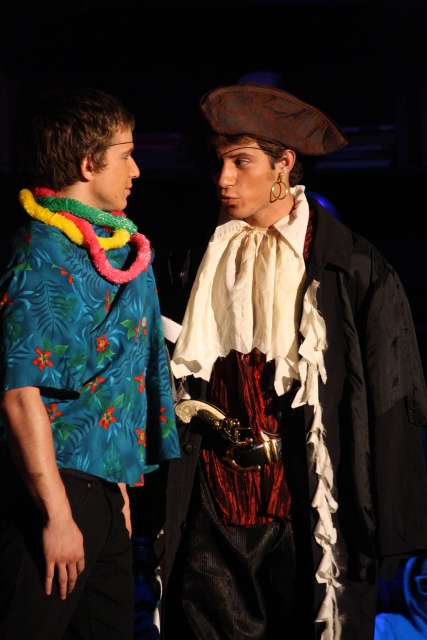
You are a costume designer trying to decide which costume element to adjust first. Based on the sizes of the rusty metal pirate hat at upper center and the teal floral shirt at left, which one should you consider modifying first if you want to ensure both elements are proportionate to each other?

The rusty metal pirate hat at upper center is bigger than the teal floral shirt at left, so you should modify the rusty metal pirate hat at upper center first to reduce its size to match the proportion of the teal floral shirt at left.

You are a costume designer assessing two props for a play. You have a rusty metal pirate hat at upper center and a teal floral shirt at left. Which prop is taller when placed side by side?

The rusty metal pirate hat at upper center is taller than the teal floral shirt at left.

From the picture: You are a costume designer measuring the distance between the rusty metal pirate hat at upper center and the teal floral shirt at left for a stage setup. The minimum required distance for proper lighting is 45 centimeters. Is the current distance sufficient?

The rusty metal pirate hat at upper center and the teal floral shirt at left are 44.67 centimeters apart from each other, which is slightly less than the required 45 centimeters. The distance is insufficient for proper lighting.